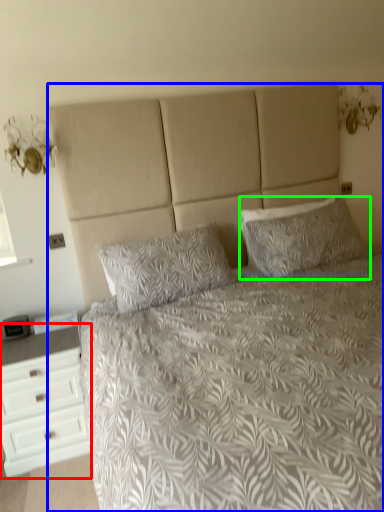
Question: Estimate the real-world distances between objects in this image. Which object is closer to chest of drawers (highlighted by a red box), bed (highlighted by a blue box) or pillow (highlighted by a green box)?

Choices:
 (A) bed
 (B) pillow

Answer: (A)